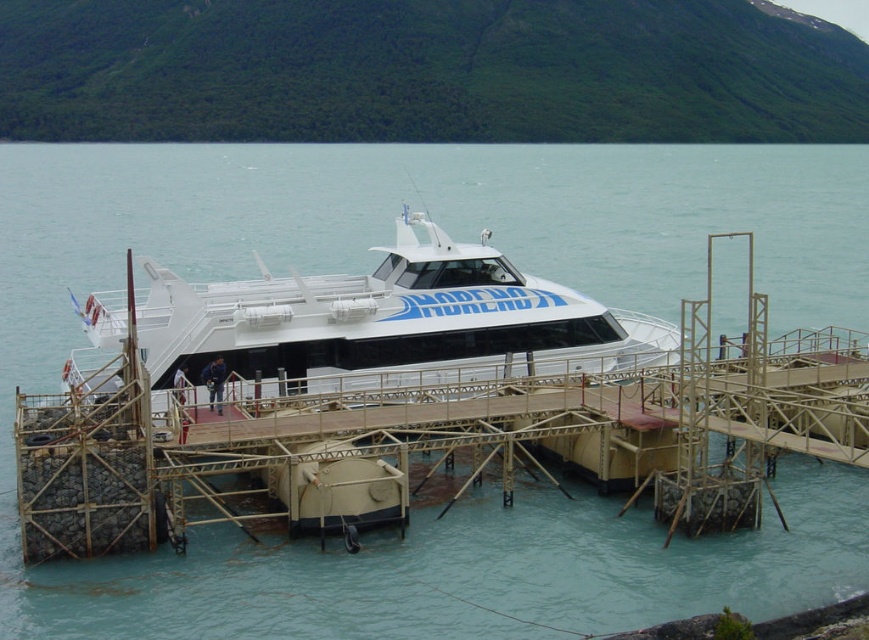
You are standing on the pier and want to reach the boat. There are two points marked on the pier that you can step on to get closer to the boat. The points are labeled as point 1 at coordinate (350, 435) and point 2 at coordinate (246, 381). Which point should you step on first to get closer to the boat?

Point 1 at coordinate (350, 435) is closer to the viewer than point 2 at coordinate (246, 381), so stepping on point 1 first will get you closer to the boat.

You are standing on the wooden dock at center. If you walk straight ahead, will you stay on the dock or enter the water?

The wooden dock at center is located at point (425, 440), so if you walk straight ahead from there, you would enter the water since the dock ends at that point.

You are a tour guide preparing to board passengers onto the wooden dock at center and the white glossy cruise ship at center. Which one can accommodate more people at the same time?

The wooden dock at center has a larger size compared to the white glossy cruise ship at center, so it can accommodate more people at the same time.